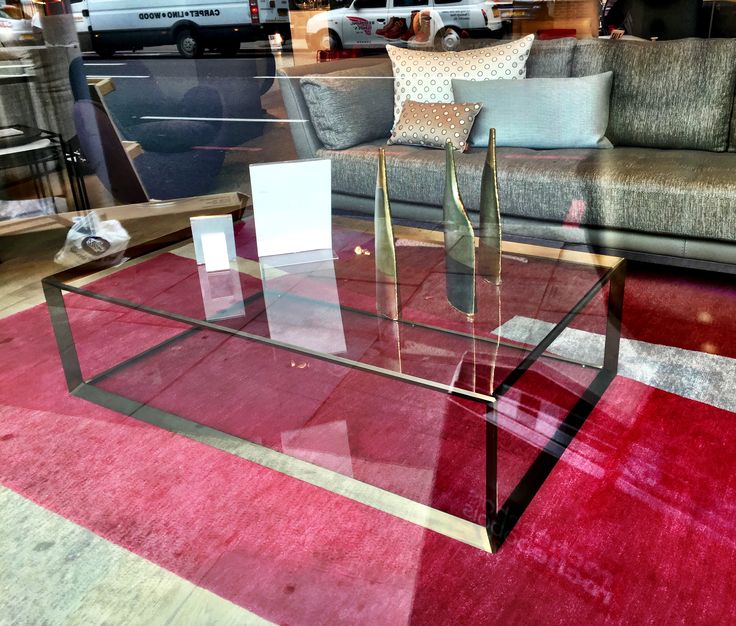
Where is `decor statues`? The width and height of the screenshot is (736, 626). decor statues is located at coordinates (459, 210), (484, 202), (392, 210).